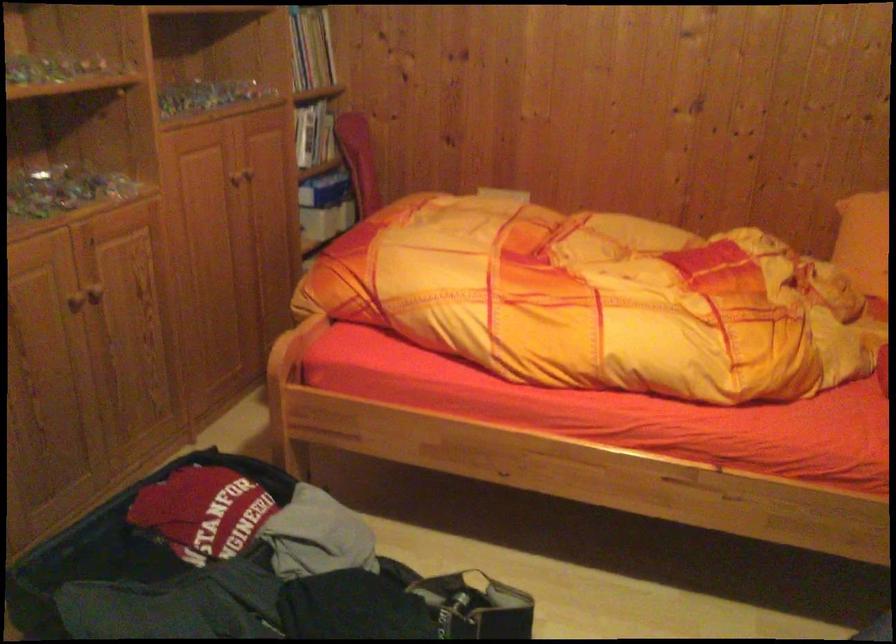
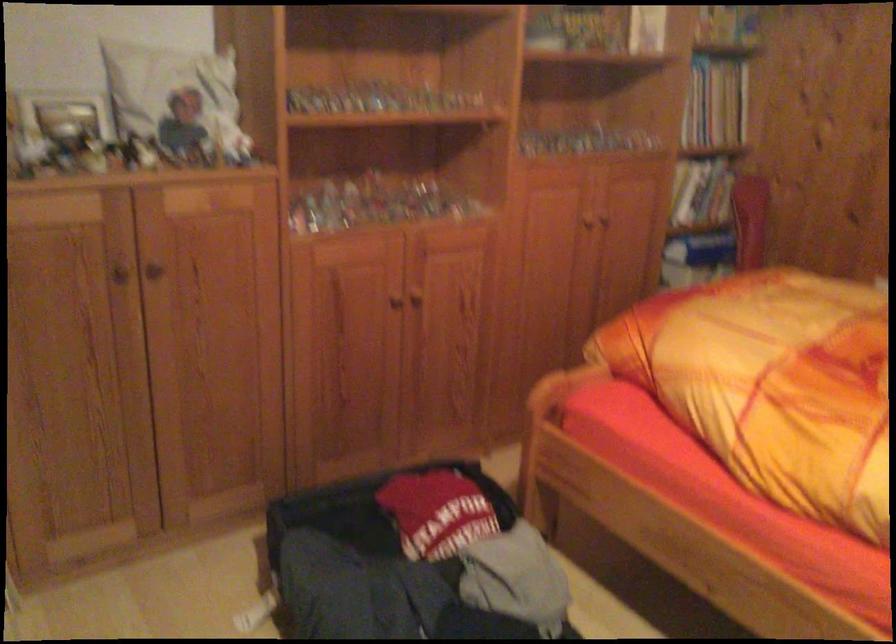
Question: How did the camera likely rotate?

Choices:
 (A) Left
 (B) Right
 (C) Up
 (D) Down

Answer: (A)